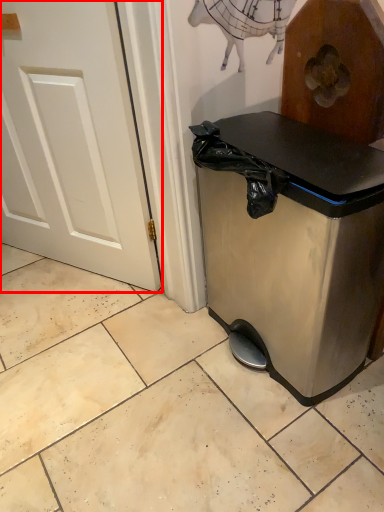
Question: From the image's perspective, where is door (annotated by the red box) located relative to waste container?

Choices:
 (A) below
 (B) above

Answer: (B)